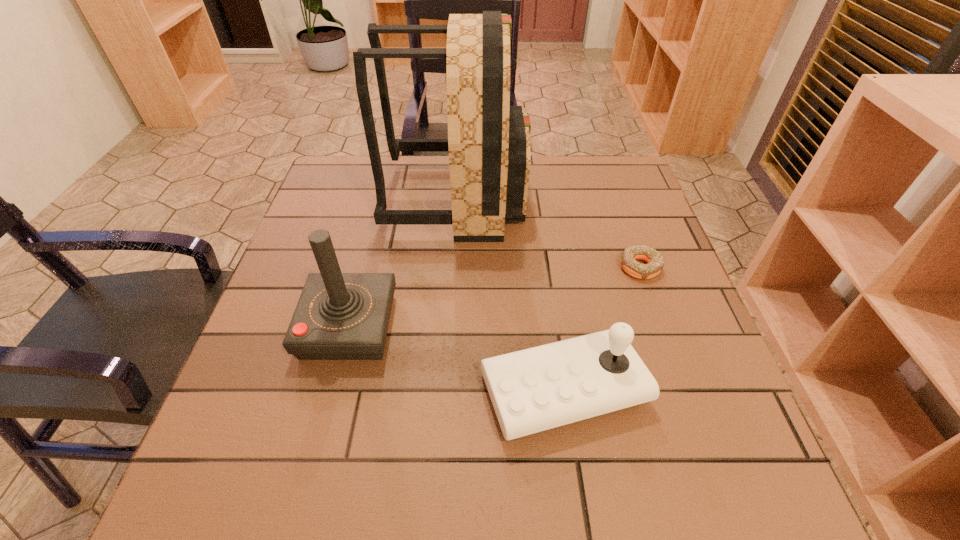
Find the location of a particular element. The image size is (960, 540). vacant space situated 0.080m on the left of the right joystick is located at coordinates (437, 389).

Where is `vacant space located 0.150m on the front of the third nearest object`? This screenshot has height=540, width=960. vacant space located 0.150m on the front of the third nearest object is located at coordinates (664, 337).

You are a GUI agent. You are given a task and a screenshot of the screen. Output one action in this format:
    pyautogui.click(x=<x>, y=<y>)
    Task: Click on the object located in the far edge section of the desktop
    This screenshot has height=540, width=960.
    Given the screenshot: What is the action you would take?
    pyautogui.click(x=488, y=141)

The width and height of the screenshot is (960, 540). In order to click on object present at the left edge in this screenshot , I will do `click(339, 316)`.

I want to click on joystick present at the right edge, so click(x=533, y=390).

Locate an element on the screen. The width and height of the screenshot is (960, 540). doughnut situated at the right edge is located at coordinates (629, 256).

Where is `vacant space at the far edge of the desktop`? Image resolution: width=960 pixels, height=540 pixels. vacant space at the far edge of the desktop is located at coordinates (564, 166).

The width and height of the screenshot is (960, 540). In order to click on free space at the near edge of the desktop in this screenshot , I will do `click(437, 485)`.

Locate an element on the screen. The width and height of the screenshot is (960, 540). vacant space at the left edge of the desktop is located at coordinates (258, 356).

Identify the location of free space at the right edge of the desktop. The width and height of the screenshot is (960, 540). (612, 237).